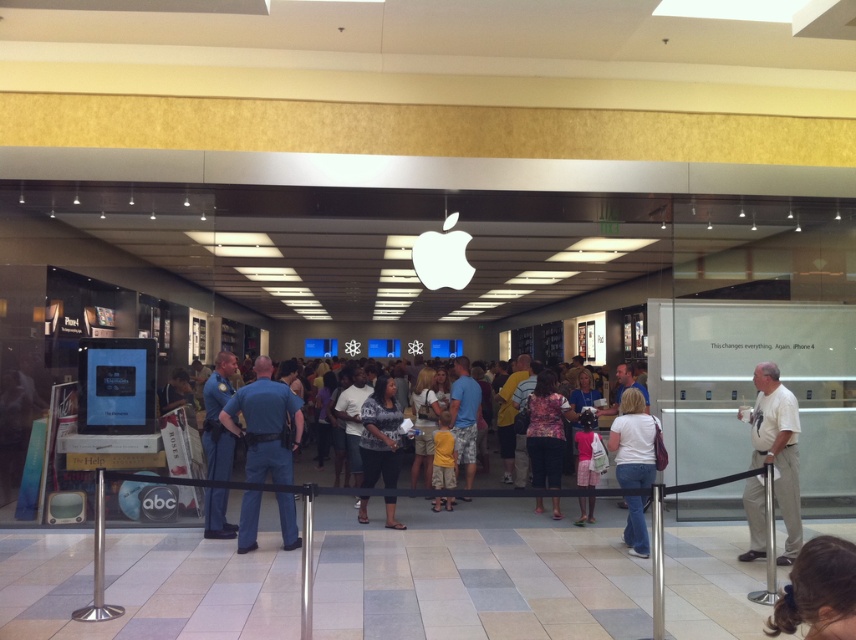
Question: Which point is closer to the camera?

Choices:
 (A) dark brown hair at lower right
 (B) blue uniform pants at center
 (C) blue jeans at center
 (D) floral fabric dress at center

Answer: (A)

Question: Can you confirm if printed fabric blouse at center is wider than floral fabric dress at center?

Choices:
 (A) no
 (B) yes

Answer: (A)

Question: Can you confirm if white matte t-shirt at center is thinner than floral fabric dress at center?

Choices:
 (A) yes
 (B) no

Answer: (A)

Question: Which of the following is the farthest from the observer?

Choices:
 (A) coord(755,493)
 (B) coord(840,561)
 (C) coord(637,472)

Answer: (C)

Question: Which point is farther to the camera?

Choices:
 (A) dark brown hair at lower right
 (B) printed fabric blouse at center
 (C) white matte t-shirt at center

Answer: (B)

Question: From the image, what is the correct spatial relationship of blue jeans at center in relation to white matte t-shirt at center?

Choices:
 (A) right
 (B) left

Answer: (B)